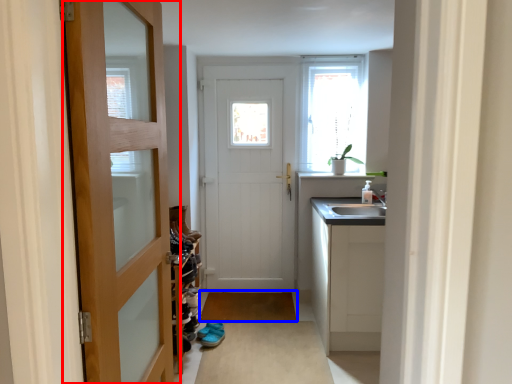
Question: Which object is further to the camera taking this photo, door (highlighted by a red box) or plain (highlighted by a blue box)?

Choices:
 (A) door
 (B) plain

Answer: (B)